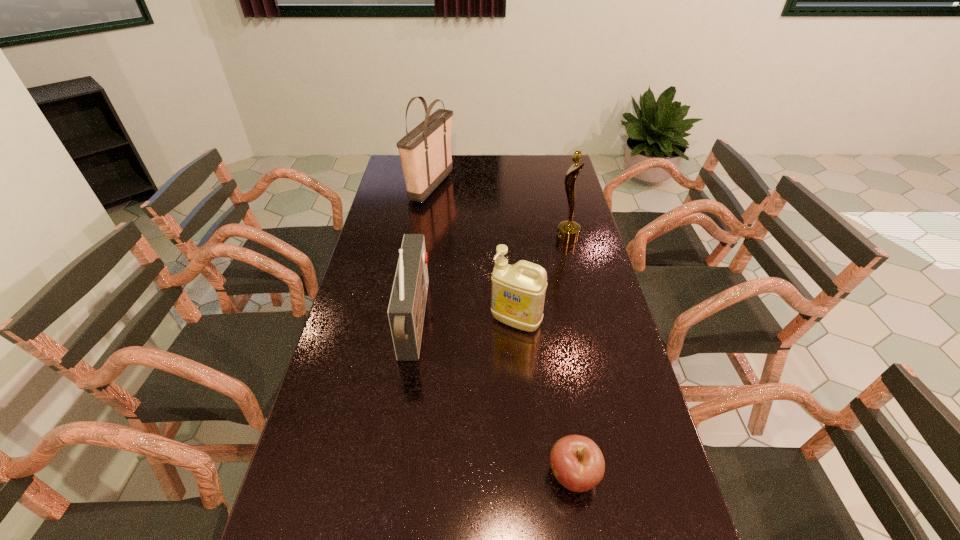
Where is `blank space located 0.210m on the front-facing side of the second farthest object`? blank space located 0.210m on the front-facing side of the second farthest object is located at coordinates (500, 238).

Image resolution: width=960 pixels, height=540 pixels. What are the coordinates of `vacant space situated on the front panel of the radio receiver` in the screenshot? It's located at (514, 322).

Identify the location of vacant space situated on the right of the detergent. (617, 321).

Find the location of a particular element. The height and width of the screenshot is (540, 960). vacant area situated on the side of the nearest object with the unique marking is located at coordinates (454, 475).

At what (x,y) coordinates should I click in order to perform the action: click on vacant region located on the side of the nearest object with the unique marking. Please return your answer as a coordinate pair (x, y). Looking at the image, I should click on (441, 475).

At what (x,y) coordinates should I click in order to perform the action: click on free space located on the side of the nearest object with the unique marking. Please return your answer as a coordinate pair (x, y). This screenshot has width=960, height=540. Looking at the image, I should click on (437, 475).

Find the location of a particular element. This screenshot has height=540, width=960. object that is at the far edge is located at coordinates (425, 152).

Where is `object that is positioned at the left edge`? This screenshot has width=960, height=540. object that is positioned at the left edge is located at coordinates (425, 152).

Find the location of a particular element. This screenshot has height=540, width=960. award at the right edge is located at coordinates (568, 232).

Identify the location of apple that is at the right edge. (577, 462).